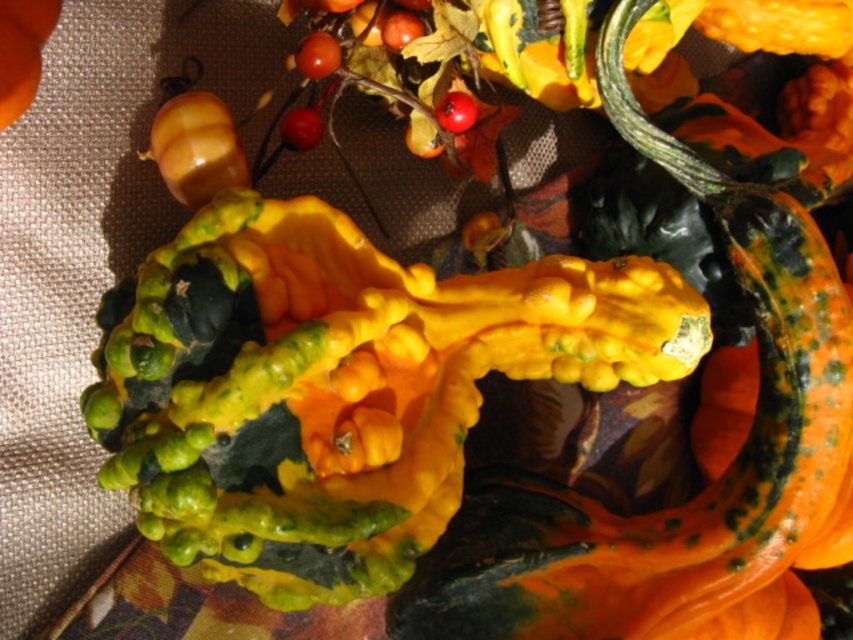
Who is lower down, matte orange pumpkin at upper left or shiny red berry at center?

Positioned lower is shiny red berry at center.

Is matte orange pumpkin at upper left above shiny red berry at center?

Yes, matte orange pumpkin at upper left is above shiny red berry at center.

Between point (33, 83) and point (306, 125), which one is positioned behind?

Positioned behind is point (306, 125).

At what (x,y) coordinates should I click in order to perform the action: click on matte orange pumpkin at upper left. Please return your answer as a coordinate pair (x, y). The height and width of the screenshot is (640, 853). Looking at the image, I should click on (22, 51).

Who is shorter, shiny red berry at center or glossy red berry at center?

With less height is glossy red berry at center.

Does shiny red berry at center have a smaller size compared to glossy red berry at center?

No.

Between point (294, 109) and point (453, 96), which one is positioned in front?

Point (453, 96) is more forward.

Identify the location of shiny red berry at center. (300, 129).

Between speckled orange gourd at center and glossy red berry at center, which one has more height?

Standing taller between the two is speckled orange gourd at center.

Between point (238, 449) and point (465, 100), which one is positioned in front?

Positioned in front is point (238, 449).

Does point (595, 381) come closer to viewer compared to point (465, 113)?

Yes, it is in front of point (465, 113).

Where is `speckled orange gourd at center`? The image size is (853, 640). speckled orange gourd at center is located at coordinates (340, 387).